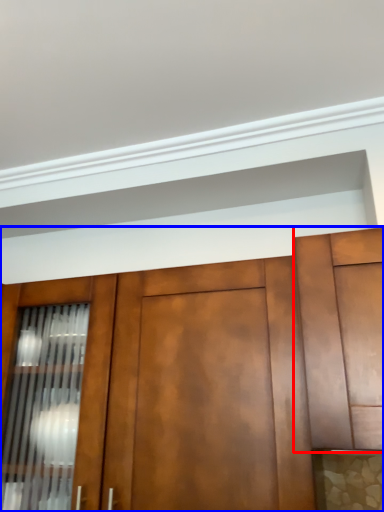
Question: Among these objects, which one is nearest to the camera, cabinetry (highlighted by a red box) or cabinetry (highlighted by a blue box)?

Choices:
 (A) cabinetry
 (B) cabinetry

Answer: (A)